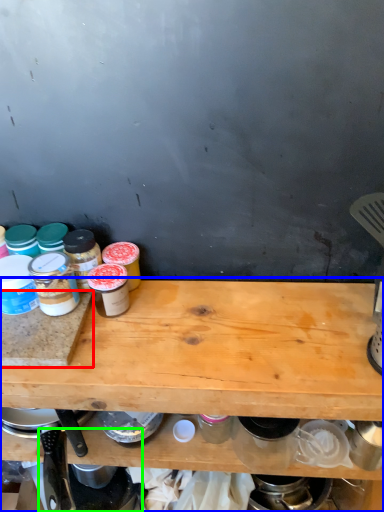
Question: Which object is the closest to the cutting board (highlighted by a red box)? Choose among these: table (highlighted by a blue box) or appliance (highlighted by a green box).

Choices:
 (A) table
 (B) appliance

Answer: (A)